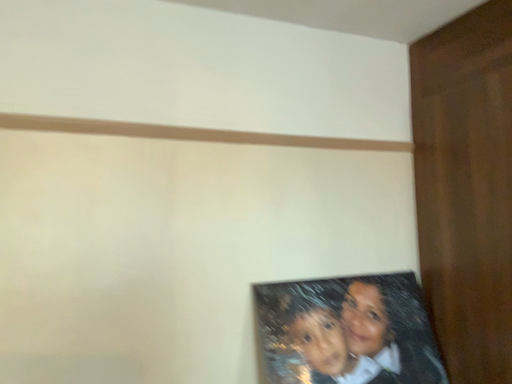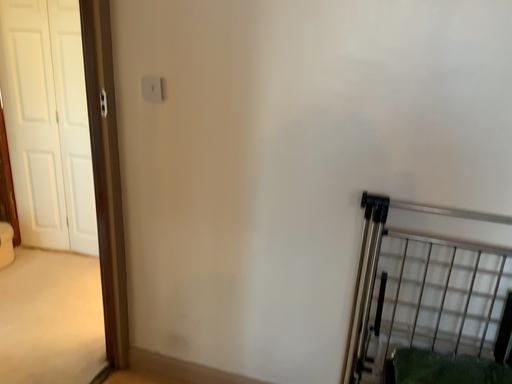
Question: Which way did the camera rotate in the video?

Choices:
 (A) rotated downward
 (B) rotated upward

Answer: (A)